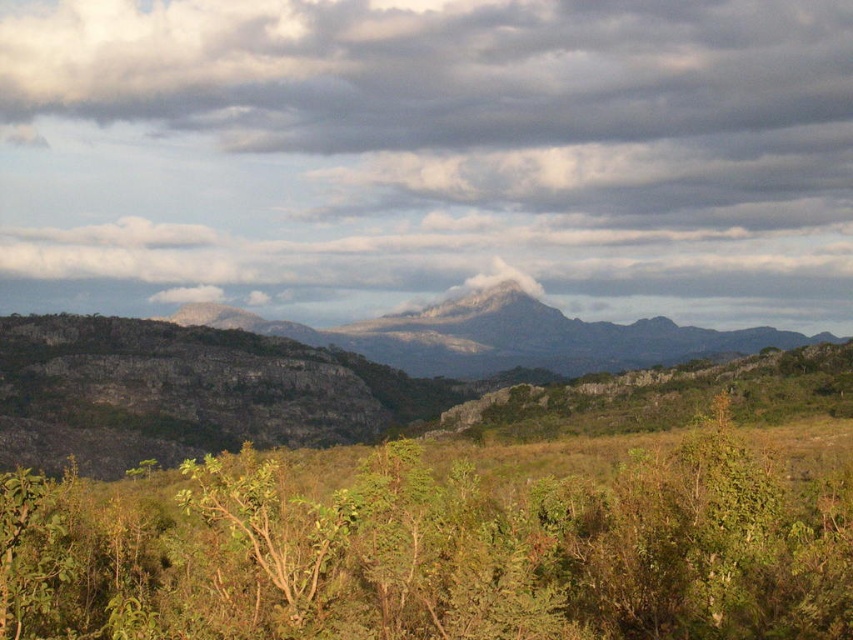
Question: Which object is farther from the camera taking this photo?

Choices:
 (A) rugged stone mountain at center
 (B) green leafy shrub at lower center
 (C) cloudy sky at upper center

Answer: (C)

Question: In this image, where is cloudy sky at upper center located relative to rugged stone mountain at center?

Choices:
 (A) below
 (B) above

Answer: (B)

Question: In this image, where is cloudy sky at upper center located relative to green leafy shrub at lower center?

Choices:
 (A) below
 (B) above

Answer: (B)

Question: Does cloudy sky at upper center have a smaller size compared to rugged stone mountain at center?

Choices:
 (A) yes
 (B) no

Answer: (B)

Question: Based on their relative distances, which object is nearer to the green leafy shrub at lower center?

Choices:
 (A) cloudy sky at upper center
 (B) rugged stone mountain at center

Answer: (B)

Question: Which point appears farthest from the camera in this image?

Choices:
 (A) (207, 308)
 (B) (67, 289)

Answer: (B)